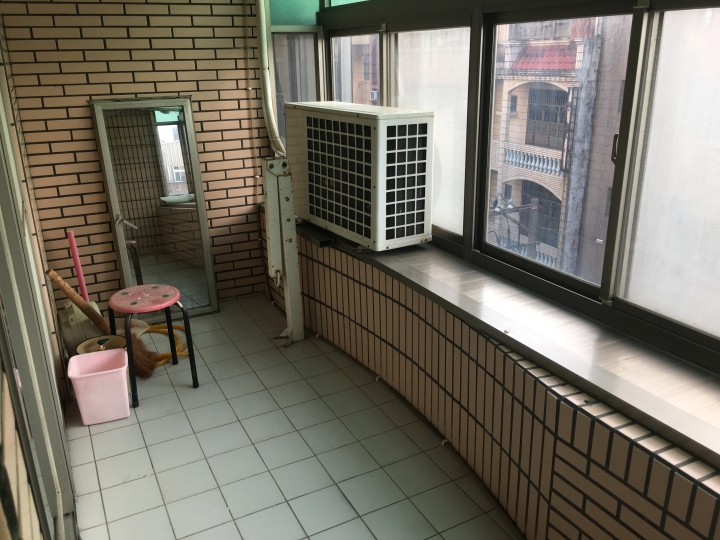
I want to click on stool, so click(x=142, y=301).